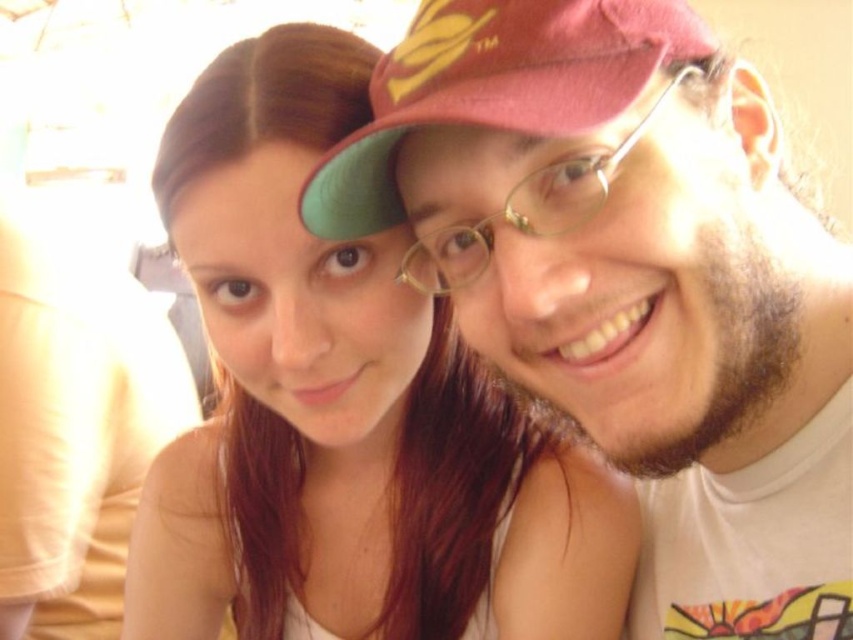
Question: From the image, what is the correct spatial relationship of matte skin at center in relation to matte red cap at upper center?

Choices:
 (A) above
 (B) below

Answer: (B)

Question: Among these points, which one is nearest to the camera?

Choices:
 (A) tap(242, 428)
 (B) tap(466, 204)
 (C) tap(613, 52)

Answer: (C)

Question: Is matte white t-shirt at center bigger than matte red cap at upper center?

Choices:
 (A) yes
 (B) no

Answer: (A)

Question: Estimate the real-world distances between objects in this image. Which object is closer to the matte red cap at upper center?

Choices:
 (A) matte white t-shirt at center
 (B) matte skin at center

Answer: (A)

Question: Is matte white t-shirt at center wider than matte red cap at upper center?

Choices:
 (A) no
 (B) yes

Answer: (B)

Question: Among these objects, which one is nearest to the camera?

Choices:
 (A) matte skin at center
 (B) matte white t-shirt at center
 (C) matte red cap at upper center

Answer: (C)